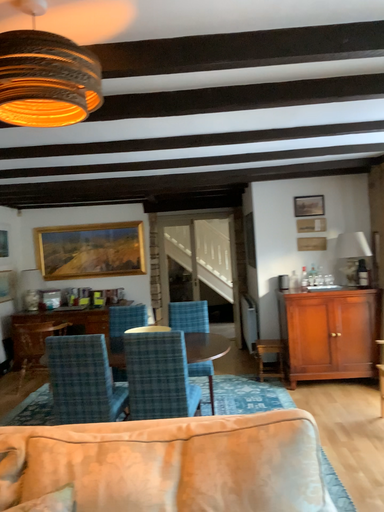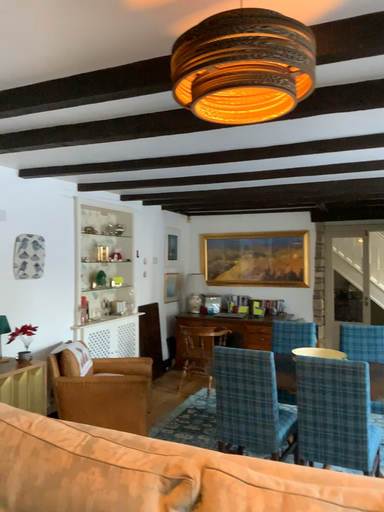
Question: How did the camera likely rotate when shooting the video?

Choices:
 (A) rotated left
 (B) rotated right

Answer: (A)